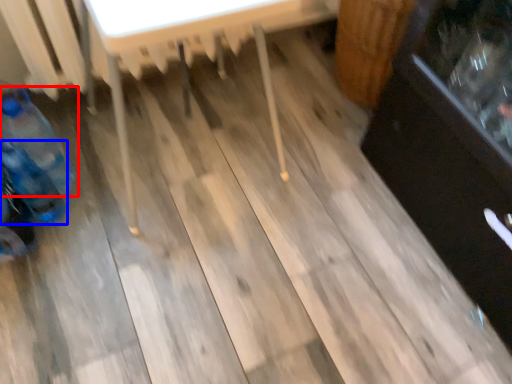
Question: Which object is further to the camera taking this photo, bottle (highlighted by a red box) or bottle (highlighted by a blue box)?

Choices:
 (A) bottle
 (B) bottle

Answer: (A)